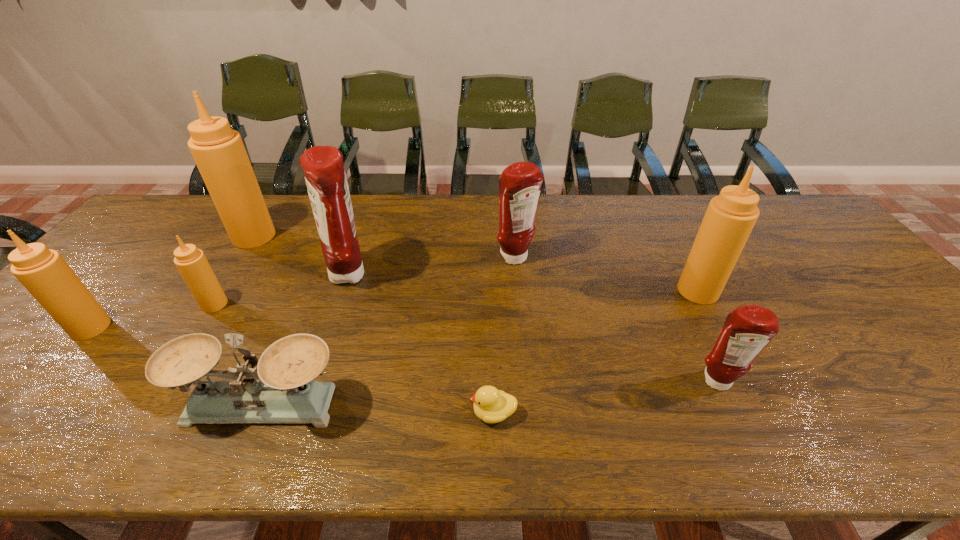
Where is `vacant point located between the tallest condiment and the smallest red condiment`? Image resolution: width=960 pixels, height=540 pixels. vacant point located between the tallest condiment and the smallest red condiment is located at coordinates (486, 309).

The width and height of the screenshot is (960, 540). I want to click on free point between the second smallest red condiment and the yellow duckling, so click(x=505, y=335).

Identify which object is the eighth nearest to the duckling. Please provide its 2D coordinates. Your answer should be formatted as a tuple, i.e. [(x, y)], where the tuple contains the x and y coordinates of a point satisfying the conditions above.

[(43, 272)]

Identify the location of object that is the fourth closest to the tallest condiment. This screenshot has height=540, width=960. (286, 393).

In order to click on condiment that is the fourth closest to the second smallest tan condiment in this screenshot , I will do `click(520, 183)`.

At what (x,y) coordinates should I click in order to perform the action: click on condiment that stands as the closest to the smallest red condiment. Please return your answer as a coordinate pair (x, y). The height and width of the screenshot is (540, 960). Looking at the image, I should click on (730, 217).

Choose which tan condiment is the second nearest neighbor to the second red condiment from left to right. Please provide its 2D coordinates. Your answer should be formatted as a tuple, i.e. [(x, y)], where the tuple contains the x and y coordinates of a point satisfying the conditions above.

[(218, 151)]

Locate an element on the screen. The height and width of the screenshot is (540, 960). the second closest tan condiment to the smallest tan condiment is located at coordinates pyautogui.click(x=218, y=151).

Locate which red condiment is the closest to the scale. Please provide its 2D coordinates. Your answer should be formatted as a tuple, i.e. [(x, y)], where the tuple contains the x and y coordinates of a point satisfying the conditions above.

[(325, 177)]

Image resolution: width=960 pixels, height=540 pixels. I want to click on red condiment that is the closest to the scale, so click(x=325, y=177).